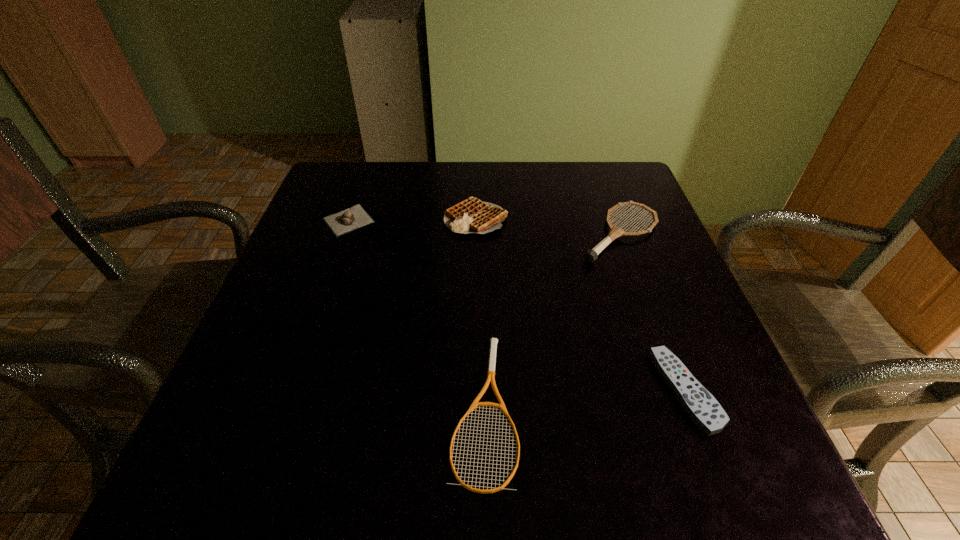
Locate an element on the screen. This screenshot has width=960, height=540. vacant space that satisfies the following two spatial constraints: 1. on the front side of the remote control; 2. on the right side of the farther tennis racket is located at coordinates click(x=677, y=391).

Find the location of a particular element. free space that satisfies the following two spatial constraints: 1. on the front side of the waffle; 2. on the right side of the farther tennis racket is located at coordinates point(476,234).